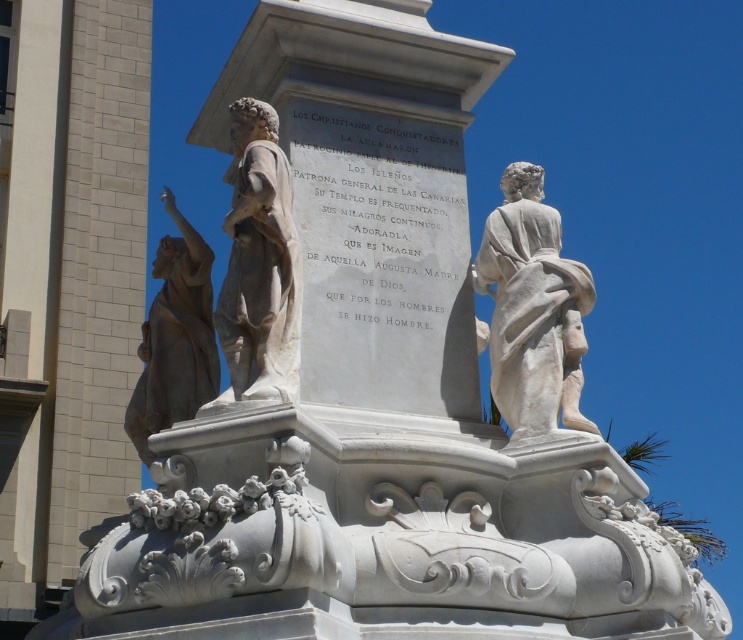
You are standing at the base of the monument and want to take a photo that includes both the white marble statue at upper right and the bronze statue at left. Given that your camera has a maximum zoom range of 15 meters, will you be able to capture both statues in a single frame without moving closer?

The white marble statue at upper right is 16.43 meters away from the bronze statue at left. Since your camera can only zoom up to 15 meters, you won generated spatial reasoning question and answer based on the provided input. 15 meters is less than 16.43 meters, so the distance between them exceeds the camera s maximum zoom range. Therefore, you cannot capture both statues in a single frame without moving closer.

You are a photographer standing in front of the monument. You want to take a photo that includes both point A at point [490,376] and point B at point [236,131]. Which point will appear closer to the bottom edge of your photo?

Point B at point [236,131] will appear closer to the bottom edge of the photo because it is farther from the camera compared to point A at point [490,376].

You are standing at the base of the monument and want to take a photo of the white marble statue at upper right. If your camera has a maximum zoom range of 50 meters, will you be able to capture a clear image of the statue from your current position?

The white marble statue at upper right is 45.40 meters away from the viewer. Since the camera can zoom up to 50 meters, it is within the maximum range, so yes, you can capture a clear image of the statue.